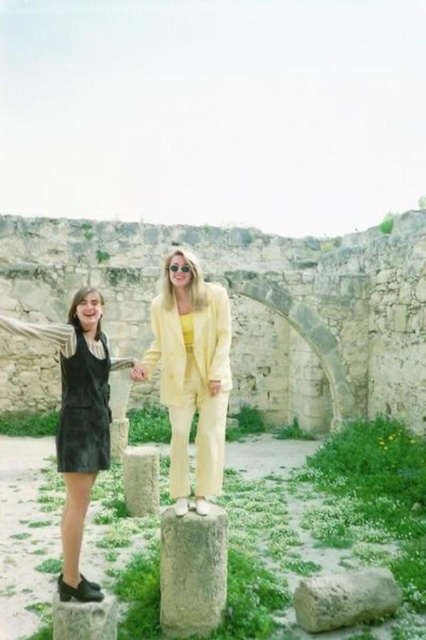
Which of these two, leather dress at left or gray stone at center, stands shorter?

Standing shorter between the two is gray stone at center.

Can you confirm if leather dress at left is shorter than gray stone at center?

No.

This screenshot has height=640, width=426. Find the location of `leather dress at left`. leather dress at left is located at coordinates (78, 422).

Between point (201, 442) and point (68, 625), which one is positioned behind?

The point (201, 442) is behind.

Is point (178, 356) less distant than point (95, 605)?

No, (178, 356) is behind (95, 605).

Describe the element at coordinates (192, 374) in the screenshot. Image resolution: width=426 pixels, height=640 pixels. I see `linen yellow suit at center` at that location.

The height and width of the screenshot is (640, 426). I want to click on linen yellow suit at center, so click(x=192, y=374).

Who is higher up, velvet black dress at left or pink fabric hand at center?

pink fabric hand at center is above.

Is velvet black dress at left below pink fabric hand at center?

Yes, velvet black dress at left is below pink fabric hand at center.

Does point (89, 401) come farther from viewer compared to point (135, 369)?

No, it is not.

Locate an element on the screen. velvet black dress at left is located at coordinates (83, 410).